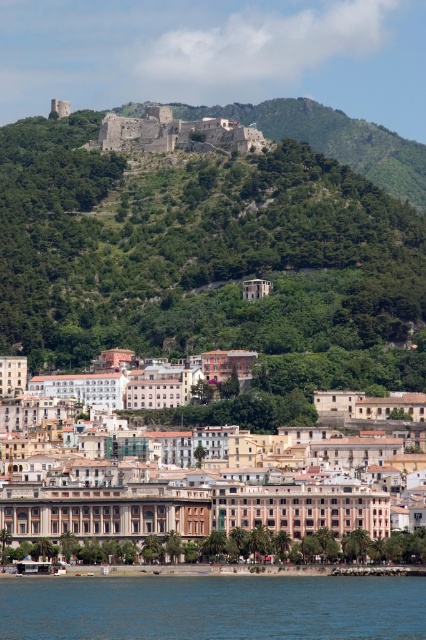
Question: Is green leafy hillside at upper center bigger than rustic stone castle at upper center?

Choices:
 (A) yes
 (B) no

Answer: (A)

Question: Which of the following is the farthest from the observer?

Choices:
 (A) rustic stone castle at upper center
 (B) blue liquid water at lower center
 (C) beige stone buildings at center

Answer: (A)

Question: From the image, what is the correct spatial relationship of green leafy hillside at upper center in relation to rustic stone castle at upper center?

Choices:
 (A) below
 (B) above

Answer: (A)

Question: Which object appears closest to the camera in this image?

Choices:
 (A) blue liquid water at lower center
 (B) rustic stone castle at upper center

Answer: (A)

Question: Does blue liquid water at lower center have a lesser width compared to rustic stone castle at upper center?

Choices:
 (A) yes
 (B) no

Answer: (A)

Question: Estimate the real-world distances between objects in this image. Which object is farther from the green leafy hillside at upper center?

Choices:
 (A) beige stone buildings at center
 (B) rustic stone castle at upper center
 (C) blue liquid water at lower center

Answer: (C)